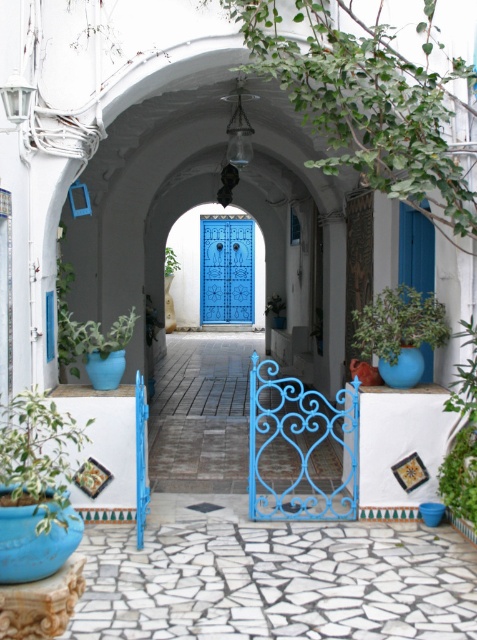
Looking at this image, who is taller, blue matte door at right or matte blue pot at lower left?

With more height is blue matte door at right.

Does blue matte door at right appear on the left side of matte blue pot at lower left?

Incorrect, blue matte door at right is not on the left side of matte blue pot at lower left.

Which is behind, point (428, 276) or point (61, 352)?

The point (428, 276) is behind.

The width and height of the screenshot is (477, 640). I want to click on blue matte door at right, so click(415, 250).

Who is shorter, blue matte door at right or green leafy plant at lower right?

green leafy plant at lower right

Does point (404, 209) come farther from viewer compared to point (439, 484)?

Yes, point (404, 209) is behind point (439, 484).

Where is `blue matte door at right`? The height and width of the screenshot is (640, 477). blue matte door at right is located at coordinates (415, 250).

Does green leafy plant at lower left appear under green leafy plant at center?

Yes, green leafy plant at lower left is below green leafy plant at center.

Can you confirm if green leafy plant at lower left is positioned to the right of green leafy plant at center?

Yes, green leafy plant at lower left is to the right of green leafy plant at center.

Is point (6, 476) farther from camera compared to point (173, 273)?

No, (6, 476) is in front of (173, 273).

At what (x,y) coordinates should I click in order to perform the action: click on green leafy plant at lower left. Please return your answer as a coordinate pair (x, y). The height and width of the screenshot is (640, 477). Looking at the image, I should click on (37, 456).